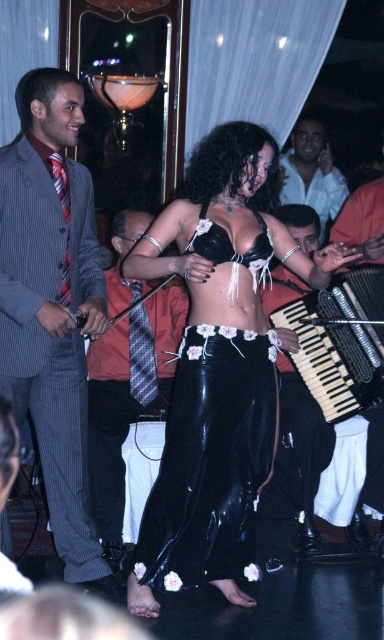
Question: Is the position of striped fabric suit at left less distant than that of light blue shirt at center?

Choices:
 (A) yes
 (B) no

Answer: (A)

Question: Can you confirm if orange shirt at center is positioned to the right of black satin bikini top at center?

Choices:
 (A) yes
 (B) no

Answer: (B)

Question: Which object appears farthest from the camera in this image?

Choices:
 (A) wooden keys at right
 (B) striped fabric suit at left

Answer: (A)

Question: Is orange shirt at center wider than wooden keys at right?

Choices:
 (A) yes
 (B) no

Answer: (B)

Question: Which object is farther from the camera taking this photo?

Choices:
 (A) light blue shirt at center
 (B) orange shirt at center
 (C) striped fabric suit at left
 (D) black shiny skirt at center

Answer: (A)

Question: Which object is positioned closest to the striped fabric suit at left?

Choices:
 (A) black shiny skirt at center
 (B) black leather skirt at center
 (C) light blue shirt at center
 (D) black satin bikini top at center

Answer: (A)